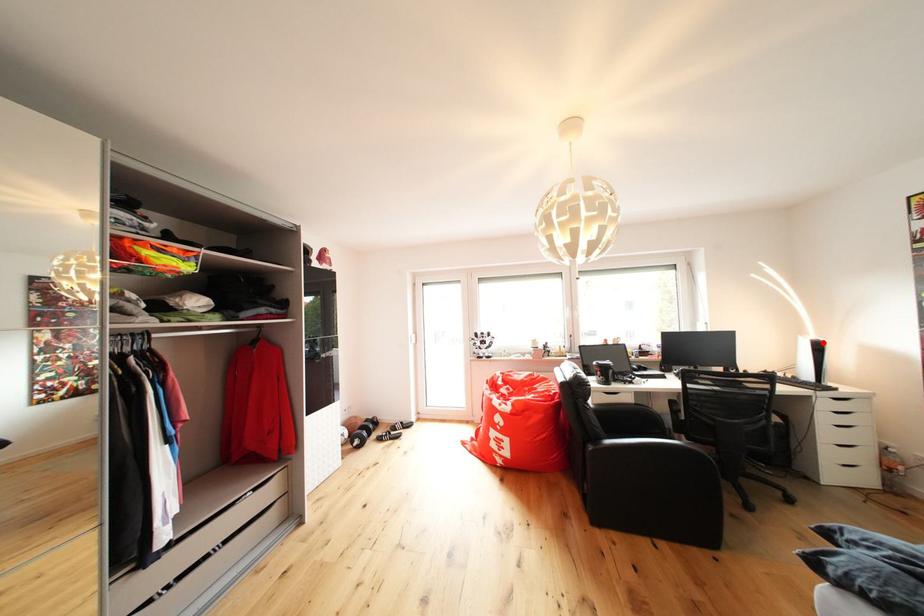
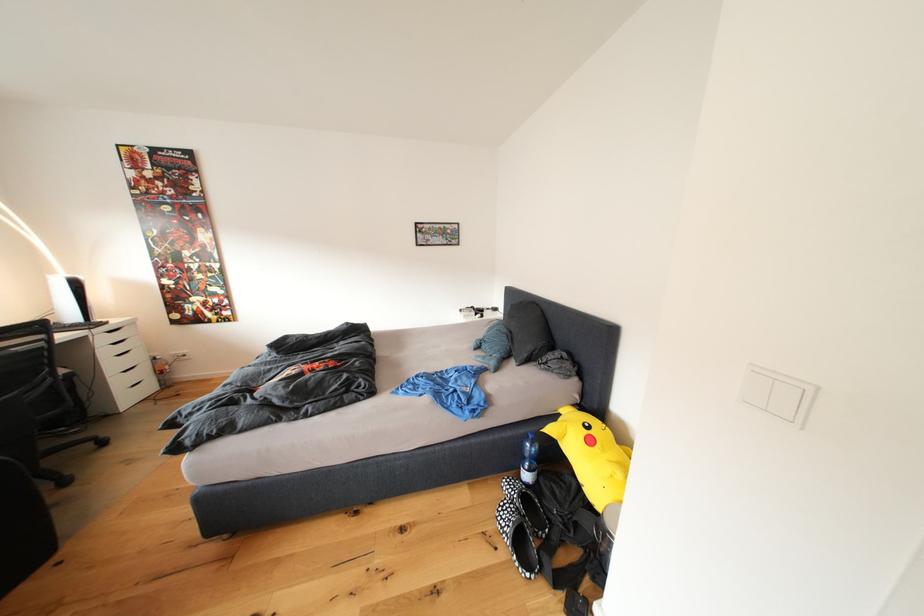
Where in the second image is the point corresponding to the highlighted location from the first image?

(76, 281)